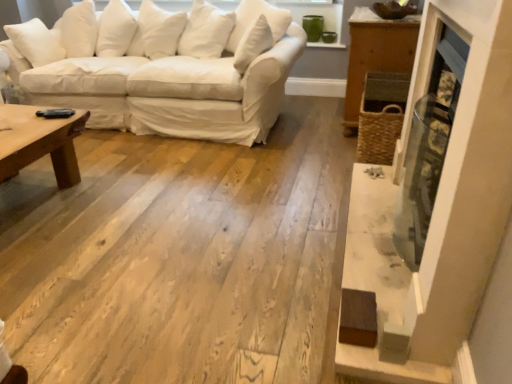
Question: Is white cotton couch at upper left located within metallic glass fireplace at right?

Choices:
 (A) yes
 (B) no

Answer: (B)

Question: From the image's perspective, does metallic glass fireplace at right appear higher than white cotton couch at upper left?

Choices:
 (A) no
 (B) yes

Answer: (A)

Question: Is there a large distance between metallic glass fireplace at right and white cotton couch at upper left?

Choices:
 (A) no
 (B) yes

Answer: (B)

Question: Considering the relative positions of metallic glass fireplace at right and white cotton couch at upper left in the image provided, is metallic glass fireplace at right to the left of white cotton couch at upper left from the viewer's perspective?

Choices:
 (A) yes
 (B) no

Answer: (B)

Question: Considering the relative sizes of metallic glass fireplace at right and white cotton couch at upper left in the image provided, is metallic glass fireplace at right wider than white cotton couch at upper left?

Choices:
 (A) yes
 (B) no

Answer: (B)

Question: Does metallic glass fireplace at right come behind white cotton couch at upper left?

Choices:
 (A) yes
 (B) no

Answer: (B)

Question: Does white cotton couch at upper left come in front of metallic glass fireplace at right?

Choices:
 (A) no
 (B) yes

Answer: (A)

Question: Is white cotton couch at upper left oriented away from metallic glass fireplace at right?

Choices:
 (A) no
 (B) yes

Answer: (A)

Question: Is white cotton couch at upper left oriented towards metallic glass fireplace at right?

Choices:
 (A) no
 (B) yes

Answer: (A)

Question: Can you confirm if white cotton couch at upper left is positioned to the right of metallic glass fireplace at right?

Choices:
 (A) yes
 (B) no

Answer: (B)

Question: Considering the relative sizes of white cotton couch at upper left and metallic glass fireplace at right in the image provided, is white cotton couch at upper left smaller than metallic glass fireplace at right?

Choices:
 (A) yes
 (B) no

Answer: (B)

Question: Does white cotton couch at upper left have a greater height compared to metallic glass fireplace at right?

Choices:
 (A) yes
 (B) no

Answer: (B)

Question: From a real-world perspective, is white cotton couch at upper left above or below metallic glass fireplace at right?

Choices:
 (A) below
 (B) above

Answer: (A)